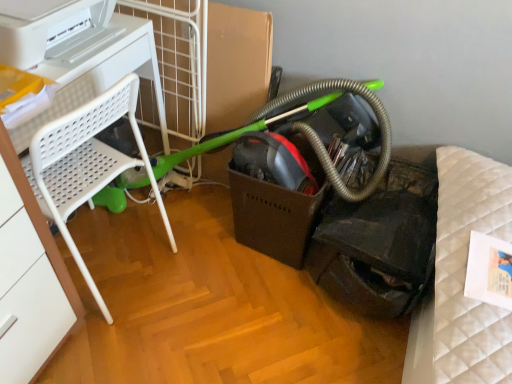
Question: From a real-world perspective, does white plastic printer at upper left sit lower than green rubber garden hose at center?

Choices:
 (A) no
 (B) yes

Answer: (A)

Question: Can you see white plastic printer at upper left touching green rubber garden hose at center?

Choices:
 (A) no
 (B) yes

Answer: (A)

Question: Is white plastic printer at upper left at the left side of green rubber garden hose at center?

Choices:
 (A) no
 (B) yes

Answer: (B)

Question: Would you say white plastic printer at upper left is a long distance from green rubber garden hose at center?

Choices:
 (A) no
 (B) yes

Answer: (A)

Question: From the image's perspective, is white plastic printer at upper left above green rubber garden hose at center?

Choices:
 (A) no
 (B) yes

Answer: (B)

Question: Is white plastic printer at upper left to the left or to the right of white plastic chair at left in the image?

Choices:
 (A) right
 (B) left

Answer: (B)

Question: Looking at the image, does white plastic printer at upper left seem bigger or smaller compared to white plastic chair at left?

Choices:
 (A) big
 (B) small

Answer: (B)

Question: From the image's perspective, relative to white plastic chair at left, is white plastic printer at upper left above or below?

Choices:
 (A) above
 (B) below

Answer: (A)

Question: Is white plastic printer at upper left spatially inside white plastic chair at left, or outside of it?

Choices:
 (A) outside
 (B) inside

Answer: (A)

Question: In terms of width, does green rubber garden hose at center look wider or thinner when compared to white plastic printer at upper left?

Choices:
 (A) wide
 (B) thin

Answer: (B)

Question: Relative to white plastic printer at upper left, is green rubber garden hose at center in front or behind?

Choices:
 (A) front
 (B) behind

Answer: (B)

Question: From the image's perspective, relative to white plastic printer at upper left, is green rubber garden hose at center above or below?

Choices:
 (A) below
 (B) above

Answer: (A)

Question: Considering the positions of point (252, 129) and point (33, 46), is point (252, 129) closer or farther from the camera than point (33, 46)?

Choices:
 (A) farther
 (B) closer

Answer: (A)

Question: Visually, is white plastic chair at left positioned to the left or to the right of green rubber garden hose at center?

Choices:
 (A) left
 (B) right

Answer: (A)

Question: Looking at their shapes, would you say white plastic chair at left is wider or thinner than green rubber garden hose at center?

Choices:
 (A) thin
 (B) wide

Answer: (B)